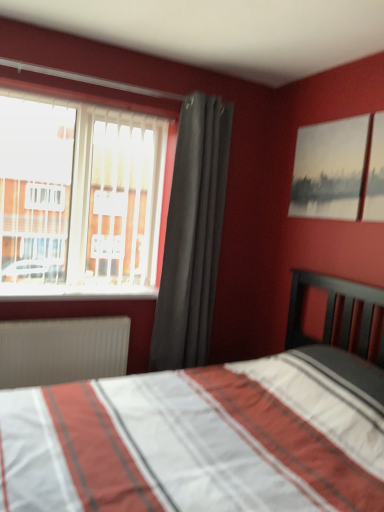
Question: Does matte gray painting at upper right have a lesser height compared to transparent glass window at upper left?

Choices:
 (A) yes
 (B) no

Answer: (A)

Question: Can you confirm if matte gray painting at upper right is wider than transparent glass window at upper left?

Choices:
 (A) no
 (B) yes

Answer: (A)

Question: From a real-world perspective, is matte gray painting at upper right positioned over transparent glass window at upper left based on gravity?

Choices:
 (A) yes
 (B) no

Answer: (A)

Question: Does matte gray painting at upper right have a smaller size compared to transparent glass window at upper left?

Choices:
 (A) yes
 (B) no

Answer: (A)

Question: From the image's perspective, does matte gray painting at upper right appear higher than transparent glass window at upper left?

Choices:
 (A) yes
 (B) no

Answer: (A)

Question: Is matte gray painting at upper right next to transparent glass window at upper left?

Choices:
 (A) no
 (B) yes

Answer: (A)

Question: Can you confirm if matte gray painting at upper right is shorter than white plastic window sill at left?

Choices:
 (A) no
 (B) yes

Answer: (A)

Question: Is matte gray painting at upper right to the right of white plastic window sill at left from the viewer's perspective?

Choices:
 (A) yes
 (B) no

Answer: (A)

Question: Is matte gray painting at upper right at the left side of white plastic window sill at left?

Choices:
 (A) no
 (B) yes

Answer: (A)

Question: Is matte gray painting at upper right facing towards white plastic window sill at left?

Choices:
 (A) no
 (B) yes

Answer: (A)

Question: Considering the relative sizes of matte gray painting at upper right and white plastic window sill at left in the image provided, is matte gray painting at upper right smaller than white plastic window sill at left?

Choices:
 (A) yes
 (B) no

Answer: (A)

Question: From a real-world perspective, does matte gray painting at upper right sit lower than white plastic window sill at left?

Choices:
 (A) no
 (B) yes

Answer: (A)

Question: Could dark gray fabric curtain at center be considered to be inside gray ribbed radiator at lower left?

Choices:
 (A) no
 (B) yes

Answer: (A)